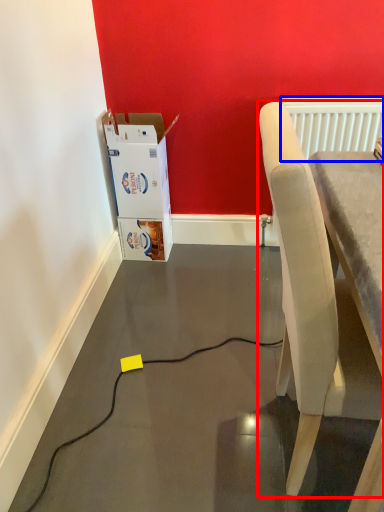
Question: Which of the following is the closest to the observer, chair (highlighted by a red box) or radiator (highlighted by a blue box)?

Choices:
 (A) chair
 (B) radiator

Answer: (A)